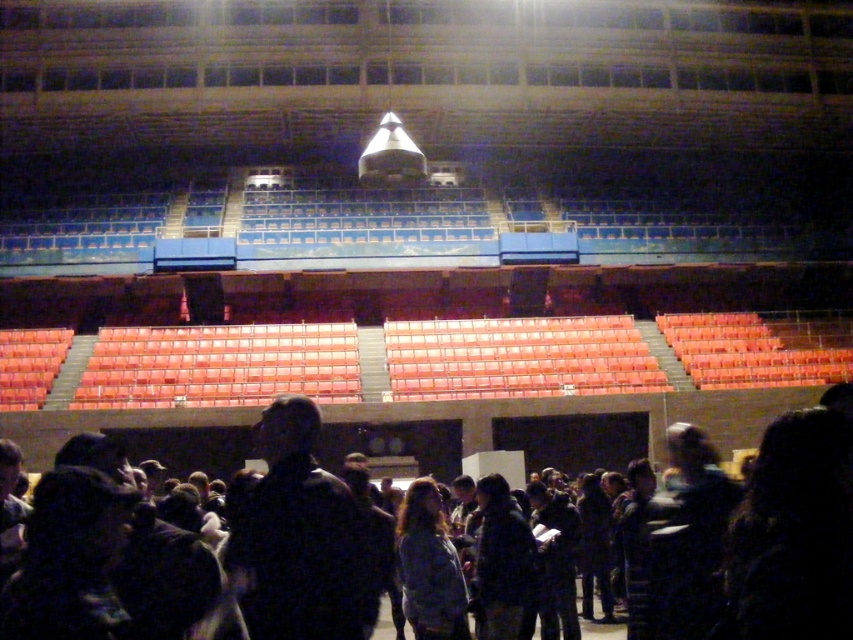
You are an event organizer trying to direct attendees to the registration desk located at the back of the arena. You notice two people in the center area wearing dark matte jacket at center and dark clothing at center. Which one should you approach first if you want to guide them to the registration desk located behind the central structure?

The dark matte jacket at center is positioned on the left side of dark clothing at center. Since the registration desk is behind the central structure, approaching the dark matte jacket at center first would be more efficient as they are closer to the left side, allowing easier navigation towards the back of the arena.